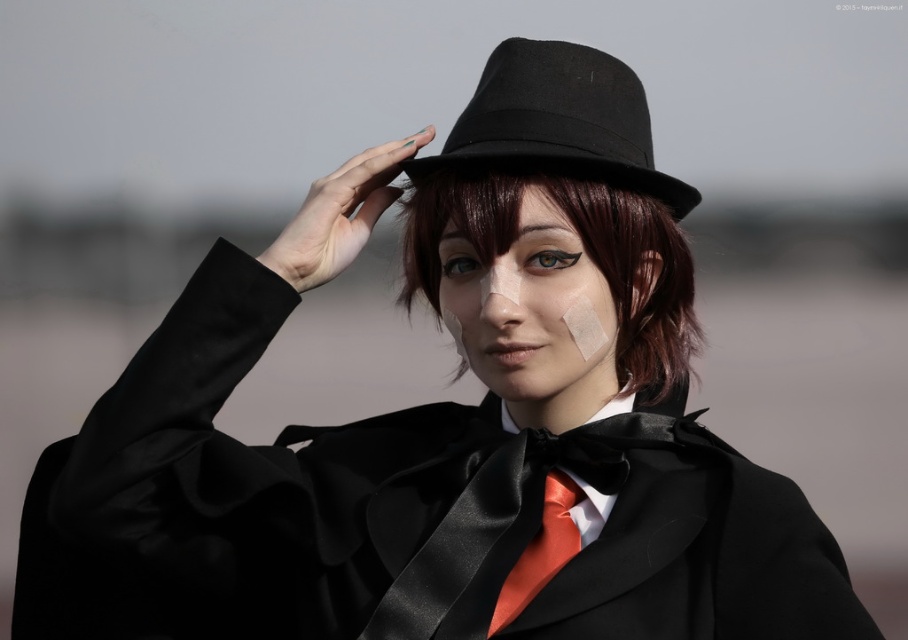
Question: Which of the following is the farthest from the observer?

Choices:
 (A) (408, 298)
 (B) (549, 76)
 (C) (551, 484)

Answer: (A)

Question: Can you confirm if dark brown silky hair at center is wider than black felt fedora at center?

Choices:
 (A) no
 (B) yes

Answer: (B)

Question: Does dark brown silky hair at center have a greater width compared to black felt fedora at center?

Choices:
 (A) yes
 (B) no

Answer: (A)

Question: Is dark brown silky hair at center closer to camera compared to black felt fedora at center?

Choices:
 (A) yes
 (B) no

Answer: (B)

Question: Which object is positioned farthest from the satin orange tie at center?

Choices:
 (A) dark brown silky hair at center
 (B) black felt fedora at center

Answer: (B)

Question: Which of the following is the farthest from the observer?

Choices:
 (A) black felt fedora at center
 (B) satin orange tie at center

Answer: (A)